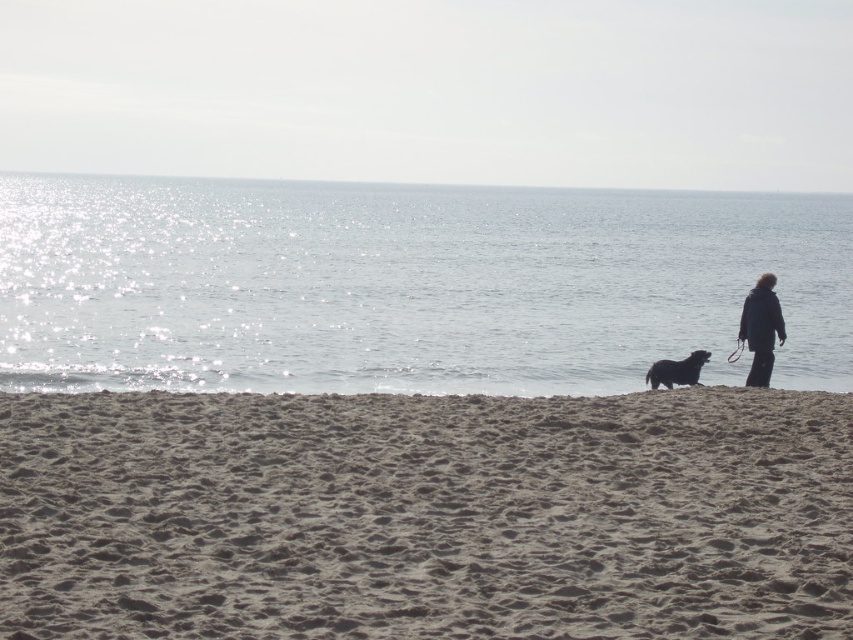
You are a hiker who needs to cross the brown sandy beach at lower center to reach the dark blue jacket at right. Can you walk across the beach without stepping on the jacket?

The brown sandy beach at lower center is narrower than the dark blue jacket at right, so the beach is not wide enough to walk across without stepping on the jacket.

You are standing at the center of the image and want to walk to the brown sandy beach at lower center. In which direction should you move?

The brown sandy beach at lower center is located at coordinates approximately 0.806 on the x axis and 0.501 on the y axis. Since you are at the center of the image, which would be at coordinates around 0.5 on both axes, you need to move towards the right and slightly downward to reach the brown sandy beach at lower center.